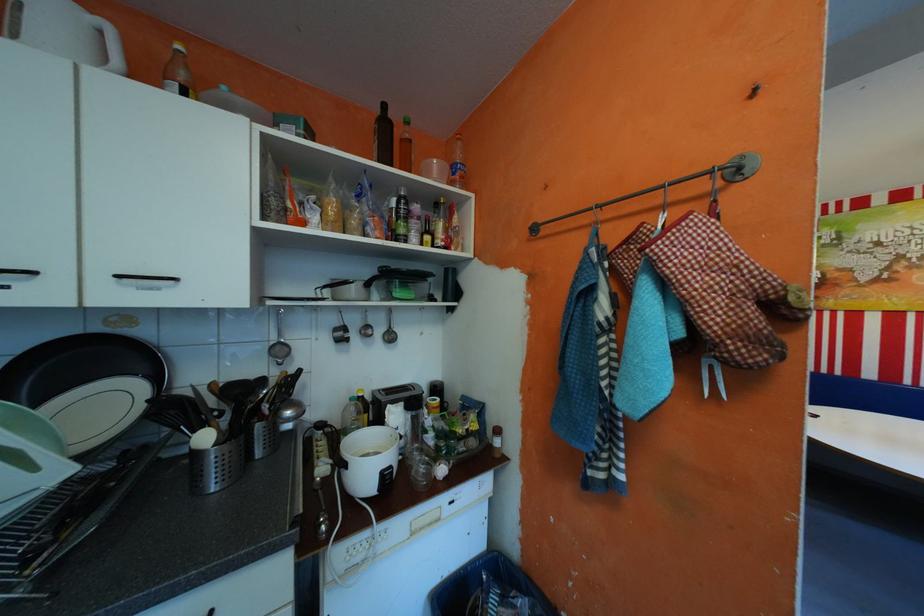
This screenshot has height=616, width=924. Describe the element at coordinates (724, 291) in the screenshot. I see `the checked oven mitt` at that location.